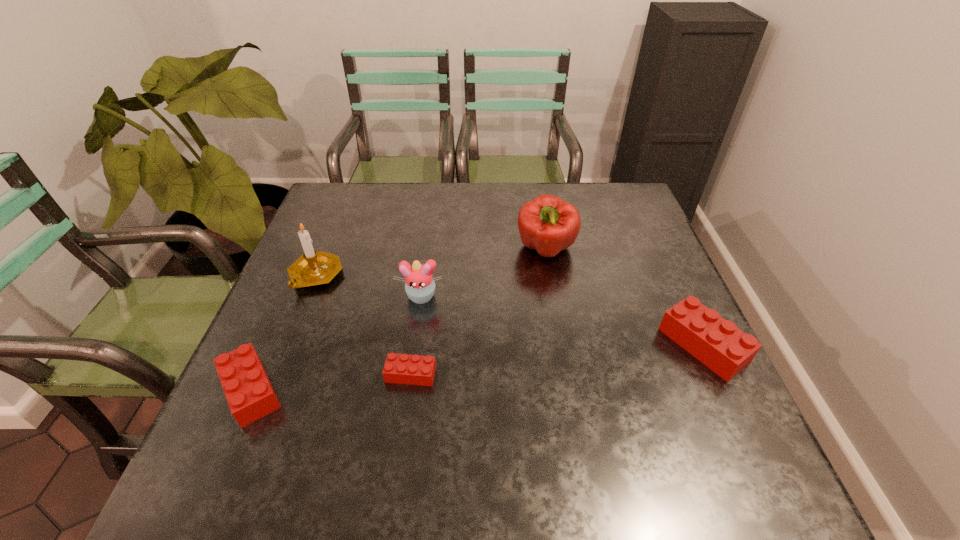
To ensure equal spacing by inserting another Lego among them, please point out a vacant spot for this new Lego. Please provide its 2D coordinates. Your answer should be formatted as a tuple, i.e. [(x, y)], where the tuple contains the x and y coordinates of a point satisfying the conditions above.

[(562, 359)]